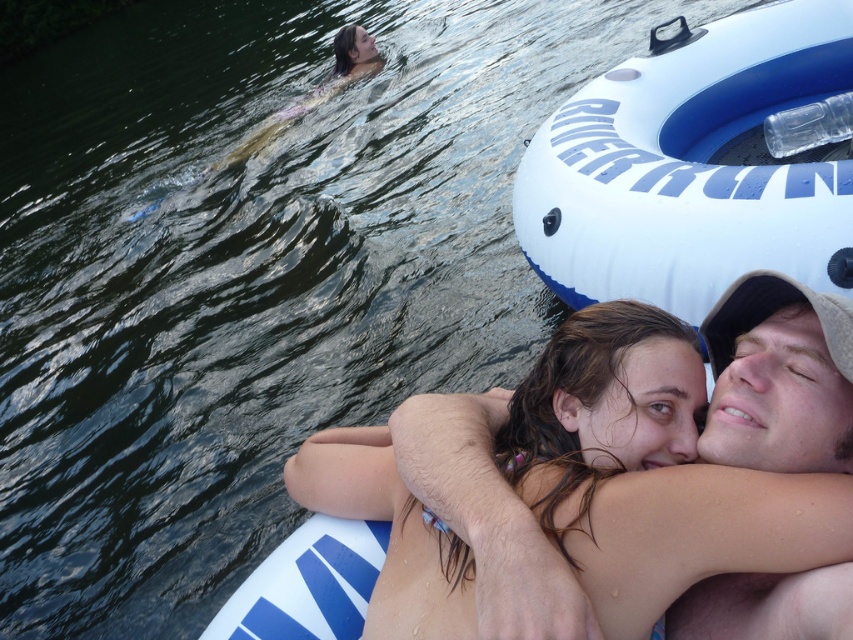
Who is higher up, white rubber ring at upper right or smooth tan skin at center?

white rubber ring at upper right

Who is shorter, white rubber ring at upper right or smooth tan skin at center?

With less height is smooth tan skin at center.

Between point (738, 272) and point (697, 624), which one is positioned in front?

Point (697, 624) is in front.

This screenshot has width=853, height=640. Identify the location of white rubber ring at upper right. (692, 168).

Which is behind, point (515, 477) or point (784, 36)?

Point (784, 36)

Does smooth skin couple at center appear on the left side of white rubber ring at upper right?

Correct, you'll find smooth skin couple at center to the left of white rubber ring at upper right.

Which is in front, point (763, 538) or point (645, 84)?

Point (763, 538)

The image size is (853, 640). I want to click on smooth skin couple at center, so click(x=692, y=500).

Looking at this image, can you confirm if smooth skin couple at center is positioned above smooth tan skin at center?

Actually, smooth skin couple at center is below smooth tan skin at center.

Identify the location of smooth skin couple at center. (692, 500).